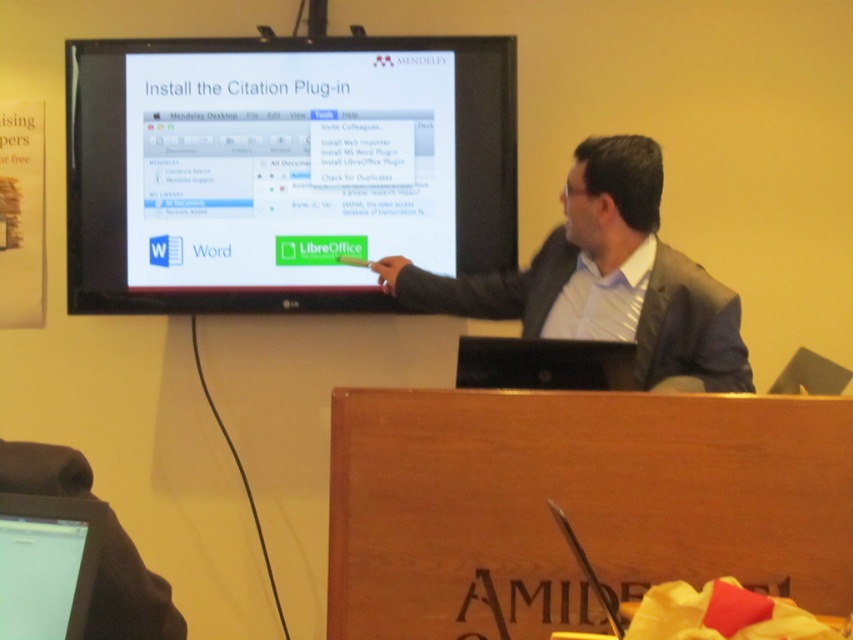
The width and height of the screenshot is (853, 640). Describe the element at coordinates (283, 168) in the screenshot. I see `matte black monitor at upper center` at that location.

Is matte black monitor at upper center shorter than wooden at center?

Incorrect, matte black monitor at upper center's height does not fall short of wooden at center's.

What are the coordinates of `matte black monitor at upper center` in the screenshot? It's located at (283, 168).

Find the location of a particular element. The width and height of the screenshot is (853, 640). matte black monitor at upper center is located at coordinates (283, 168).

Is white glossy screen at lower left bigger than black plastic laptop at center?

No, white glossy screen at lower left is not bigger than black plastic laptop at center.

Between white glossy screen at lower left and black plastic laptop at center, which one is positioned higher?

black plastic laptop at center

Where is `white glossy screen at lower left`? This screenshot has width=853, height=640. white glossy screen at lower left is located at coordinates (38, 576).

Can you confirm if matte black monitor at upper center is positioned to the right of black plastic laptop at center?

In fact, matte black monitor at upper center is to the left of black plastic laptop at center.

Does point (364, 291) come behind point (515, 387)?

Yes, it is.

What do you see at coordinates (283, 168) in the screenshot?
I see `matte black monitor at upper center` at bounding box center [283, 168].

You are a GUI agent. You are given a task and a screenshot of the screen. Output one action in this format:
    pyautogui.click(x=<x>, y=<y>)
    Task: Click on the matte black monitor at upper center
    The height and width of the screenshot is (640, 853).
    Given the screenshot: What is the action you would take?
    pyautogui.click(x=283, y=168)